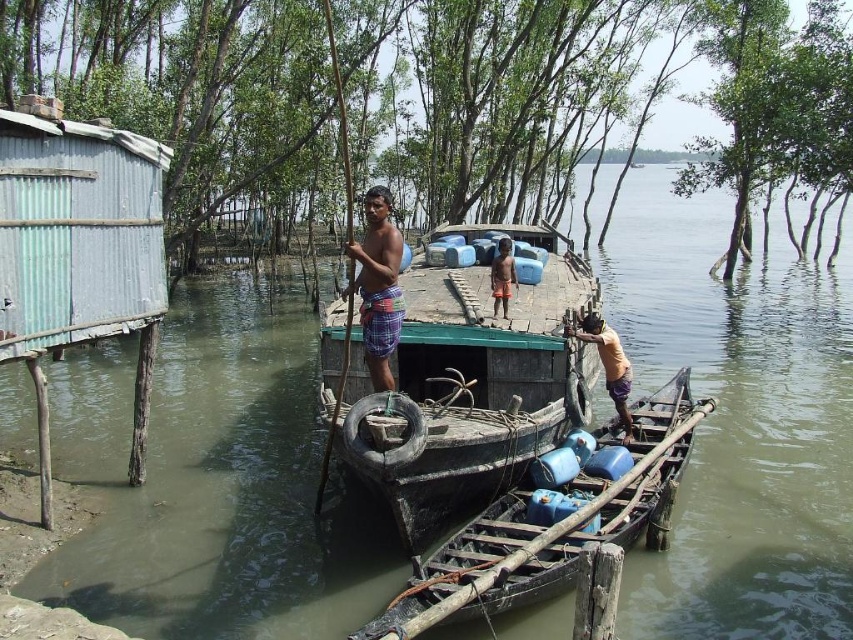
Between wooden boat at center and orange plaid shorts at center, which one is positioned higher?

wooden boat at center is higher up.

Between point (585, 352) and point (505, 296), which one is positioned behind?

Point (505, 296)

The width and height of the screenshot is (853, 640). What do you see at coordinates (467, 378) in the screenshot?
I see `wooden boat at center` at bounding box center [467, 378].

This screenshot has height=640, width=853. Find the location of `wooden boat at center`. wooden boat at center is located at coordinates coord(467,378).

Is green corrugated metal hut at left bigger than rusty wood boat at center?

Correct, green corrugated metal hut at left is larger in size than rusty wood boat at center.

Looking at this image, does green corrugated metal hut at left appear on the left side of rusty wood boat at center?

Correct, you'll find green corrugated metal hut at left to the left of rusty wood boat at center.

Between point (102, 221) and point (521, 572), which one is positioned in front?

Point (521, 572) is more forward.

Where is `green corrugated metal hut at left`? The width and height of the screenshot is (853, 640). green corrugated metal hut at left is located at coordinates (77, 232).

Can you confirm if green wooden boat at center is positioned to the left of plaid fabric shorts at center?

In fact, green wooden boat at center is to the right of plaid fabric shorts at center.

Is green wooden boat at center smaller than plaid fabric shorts at center?

Actually, green wooden boat at center might be larger than plaid fabric shorts at center.

Is point (212, 448) positioned in front of point (381, 328)?

No, (212, 448) is further to viewer.

Where is `green wooden boat at center`? The image size is (853, 640). green wooden boat at center is located at coordinates (212, 484).